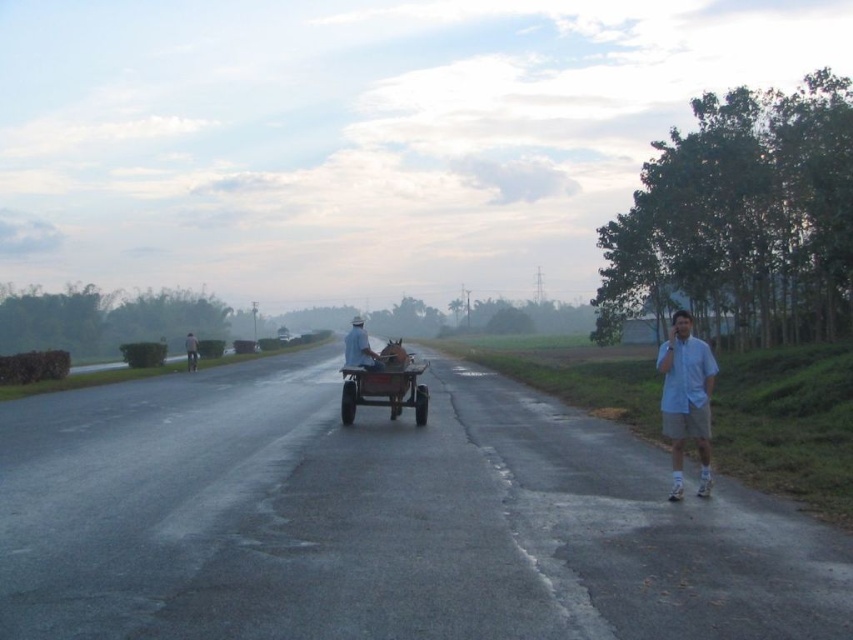
You are a photographer standing at the edge of the road. You want to capture both the light blue shirt at right and the brown wooden horse cart at center in a single photo. Which object should you focus on first to ensure both are in frame?

You should focus on the brown wooden horse cart at center first because it is larger than the light blue shirt at right, ensuring it fits within the frame while the smaller object will also be captured.